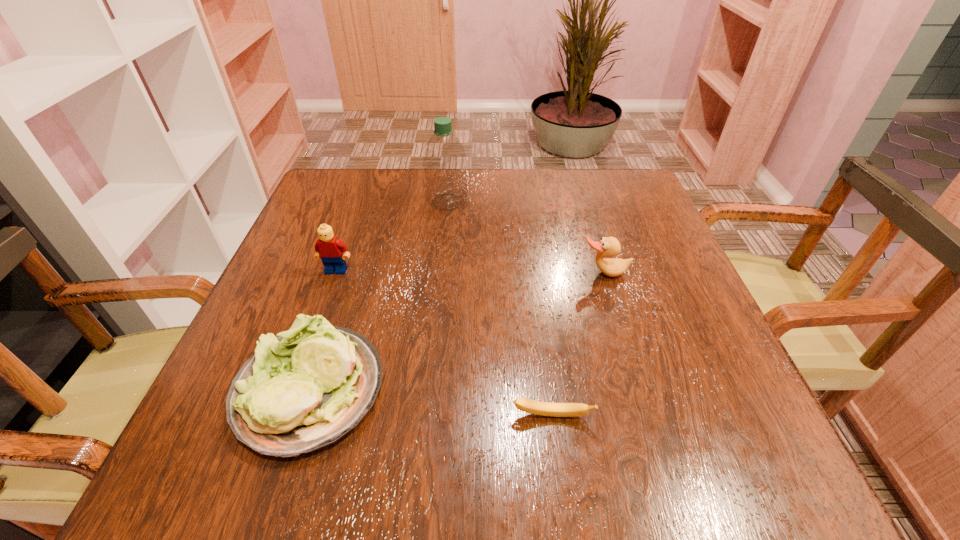
You are a GUI agent. You are given a task and a screenshot of the screen. Output one action in this format:
    pyautogui.click(x=<x>, y=<y>)
    Task: Click on the third object from left to right
    This screenshot has height=540, width=960.
    Given the screenshot: What is the action you would take?
    pyautogui.click(x=444, y=161)

Where is `the farthest object`? the farthest object is located at coordinates (444, 161).

Identify the location of Lego. The image size is (960, 540). (329, 248).

I want to click on duck, so click(x=608, y=247).

The width and height of the screenshot is (960, 540). Identify the location of lettuce. (304, 389).

In order to click on the shortest object in this screenshot , I will do `click(526, 405)`.

Locate an element on the screen. This screenshot has width=960, height=540. banana is located at coordinates (526, 405).

This screenshot has height=540, width=960. Identify the location of free spot located on the front of the third object from left to right. (435, 332).

This screenshot has height=540, width=960. I want to click on blank space located 0.120m on the front-facing side of the fourth shortest object, so click(319, 319).

Where is `vacant space located 0.310m on the beak of the rightmost object`? This screenshot has width=960, height=540. vacant space located 0.310m on the beak of the rightmost object is located at coordinates (649, 422).